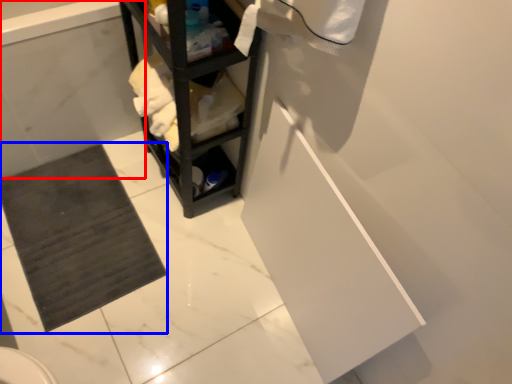
Question: Which of the following is the closest to the observer, bath (highlighted by a red box) or bath mat (highlighted by a blue box)?

Choices:
 (A) bath
 (B) bath mat

Answer: (A)